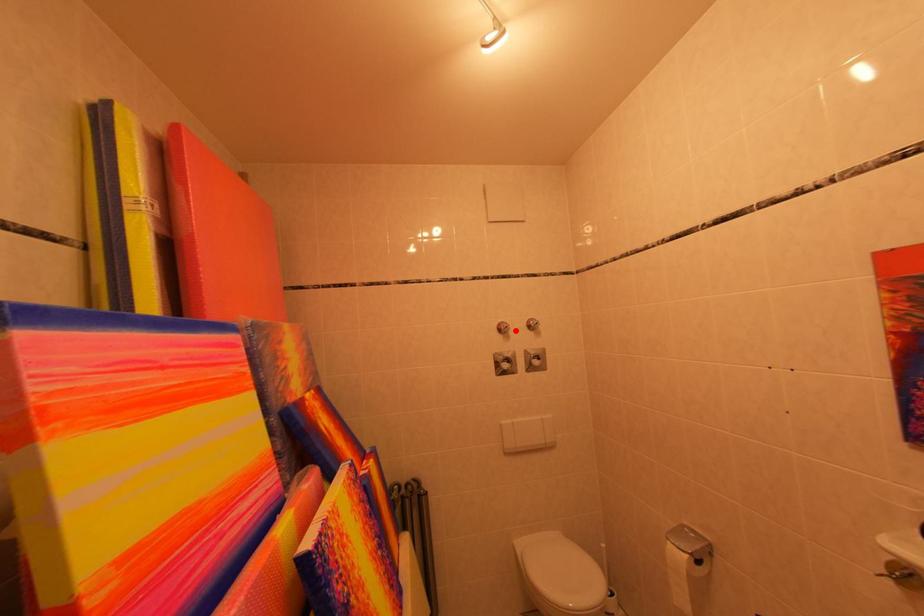
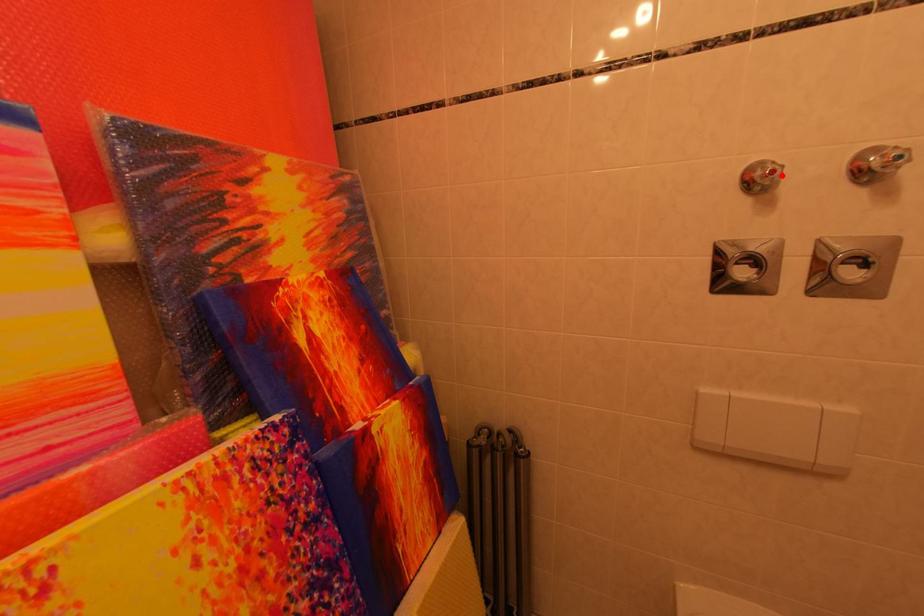
I am providing you with two images of the same scene from different viewpoints. A red point is marked on the first image and another point is marked on the second image. Are the points marked in image1 and image2 representing the same 3D position?

Yes